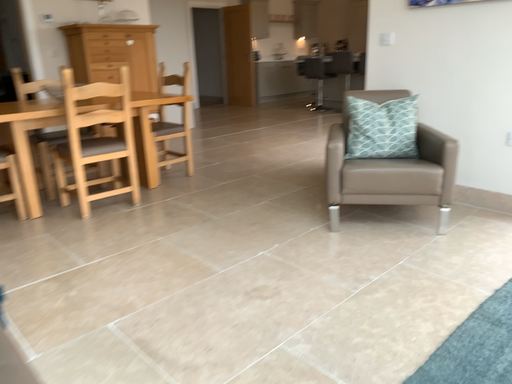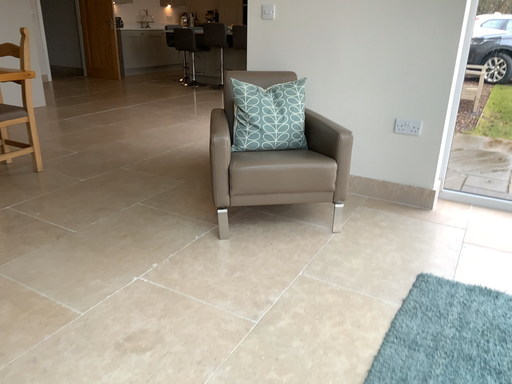
Question: Which way did the camera rotate in the video?

Choices:
 (A) rotated left
 (B) rotated right

Answer: (B)